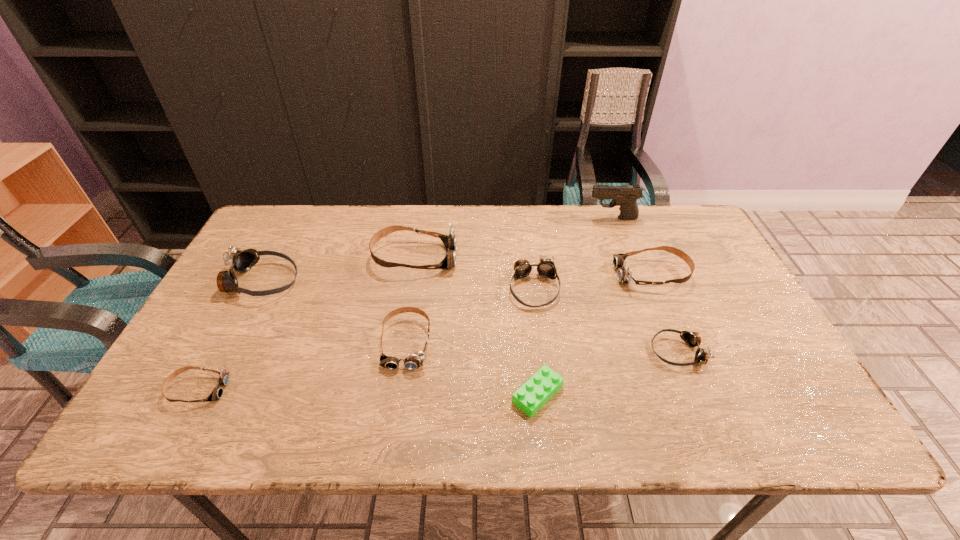
The image size is (960, 540). Find the location of `the farthest object`. the farthest object is located at coordinates (625, 196).

Where is `the tallest object`? This screenshot has width=960, height=540. the tallest object is located at coordinates tap(625, 196).

Where is `the biggest brown goggles`? The height and width of the screenshot is (540, 960). the biggest brown goggles is located at coordinates (449, 240).

At what (x,y) coordinates should I click in order to perform the action: click on the leftmost bronze goggles. Please return your answer as a coordinate pair (x, y). This screenshot has height=540, width=960. Looking at the image, I should click on (240, 261).

Locate an element on the screen. the rightmost brown goggles is located at coordinates (624, 275).

Image resolution: width=960 pixels, height=540 pixels. I want to click on the third goggles from right to left, so click(x=546, y=268).

Where is `the second smallest bronze goggles`? The image size is (960, 540). the second smallest bronze goggles is located at coordinates (546, 268).

Where is `the second smallest brown goggles`? the second smallest brown goggles is located at coordinates (414, 361).

This screenshot has width=960, height=540. Find the location of `the rightmost bronze goggles`. the rightmost bronze goggles is located at coordinates 692,339.

You are a GUI agent. You are given a task and a screenshot of the screen. Output one action in this format:
    pyautogui.click(x=<x>, y=<y>)
    Task: Click on the nearest bronze goggles
    This screenshot has height=540, width=960.
    Given the screenshot: What is the action you would take?
    pyautogui.click(x=692, y=339)